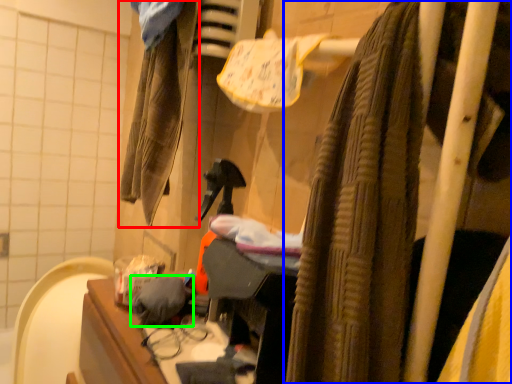
Question: Considering the real-world distances, which object is farthest from clothing (highlighted by a red box)? curtain (highlighted by a blue box) or clothing (highlighted by a green box)?

Choices:
 (A) curtain
 (B) clothing

Answer: (A)